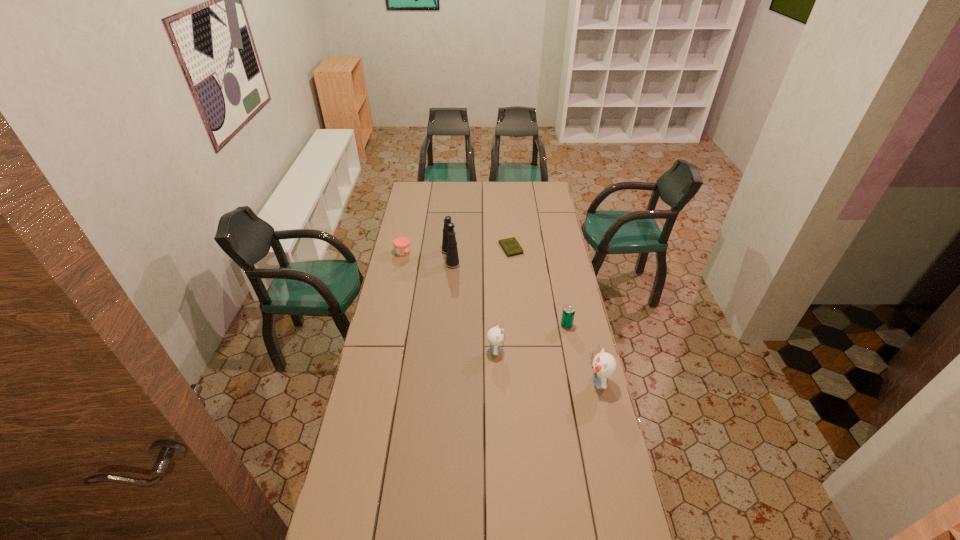
Identify the location of kitten that is at the right edge. The image size is (960, 540). (604, 365).

What are the coordinates of `beer can located at the right edge` in the screenshot? It's located at (568, 313).

This screenshot has width=960, height=540. I want to click on vacant region at the far edge of the desktop, so click(486, 188).

Find the location of a particular element. Image resolution: width=960 pixels, height=540 pixels. vacant area at the near edge is located at coordinates (397, 528).

This screenshot has width=960, height=540. What are the coordinates of `vacant space at the left edge of the desktop` in the screenshot? It's located at (417, 288).

Where is `free location at the right edge of the desktop`? free location at the right edge of the desktop is located at coordinates click(588, 357).

The image size is (960, 540). What are the coordinates of `vacant space at the far left corner` in the screenshot? It's located at (427, 197).

Find the location of a particular element. vacant point located between the shorter kitten and the fifth object from right to left is located at coordinates (473, 304).

This screenshot has width=960, height=540. Identify the location of vacant area that lies between the second nearest object and the fifth object from left to right. (531, 338).

Find the location of a particular element. The image size is (960, 540). vacant space in between the left kitten and the third shortest object is located at coordinates (531, 338).